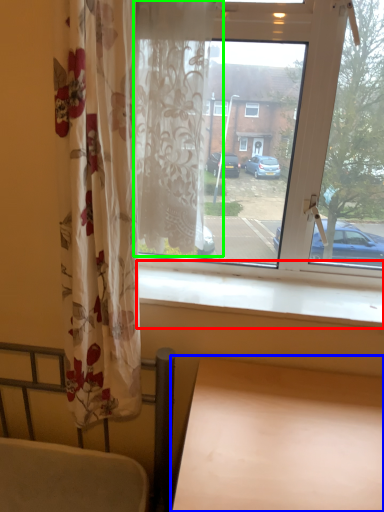
Question: Based on their relative distances, which object is nearer to window sill (highlighted by a red box)? Choose from table (highlighted by a blue box) and curtain (highlighted by a green box).

Choices:
 (A) table
 (B) curtain

Answer: (A)